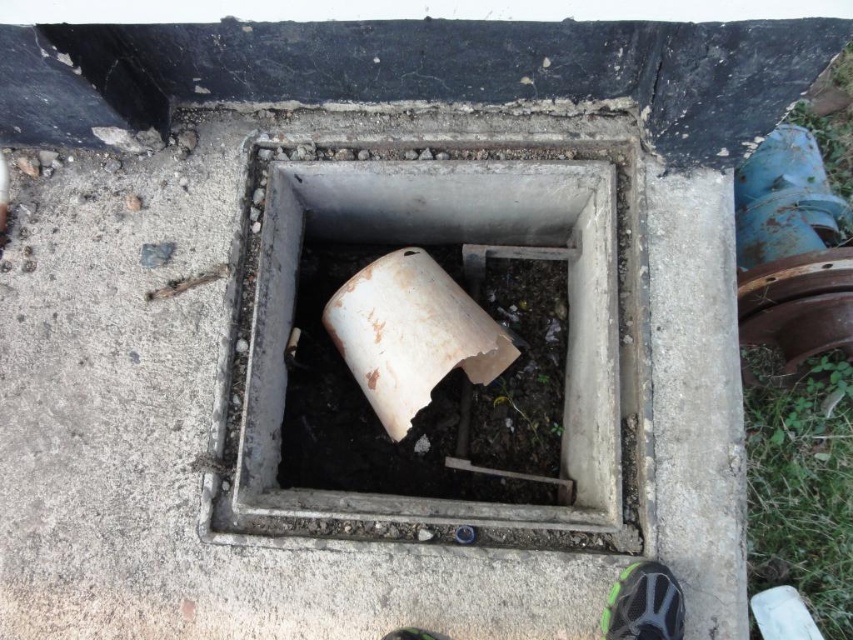
Who is shorter, white matte pipe at center or green matte shoe at lower center?

green matte shoe at lower center

Does white matte pipe at center have a lesser height compared to green matte shoe at lower center?

No.

Between point (498, 483) and point (432, 636), which one is positioned behind?

Point (498, 483)

Find the location of a particular element. The width and height of the screenshot is (853, 640). white matte pipe at center is located at coordinates (447, 374).

Which of these two, white matte cement at center or white matte pipe at center, stands taller?

Standing taller between the two is white matte cement at center.

Which is in front, point (59, 637) or point (519, 403)?

Point (59, 637)

The height and width of the screenshot is (640, 853). I want to click on white matte cement at center, so click(231, 396).

Between green fabric shoe at lower right and green matte shoe at lower center, which one is positioned higher?

green fabric shoe at lower right is higher up.

Between point (666, 584) and point (421, 634), which one is positioned behind?

The point (421, 634) is more distant.

You are a GUI agent. You are given a task and a screenshot of the screen. Output one action in this format:
    pyautogui.click(x=<x>, y=<y>)
    Task: Click on the green fabric shoe at lower right
    The image size is (853, 640).
    Given the screenshot: What is the action you would take?
    pyautogui.click(x=643, y=604)